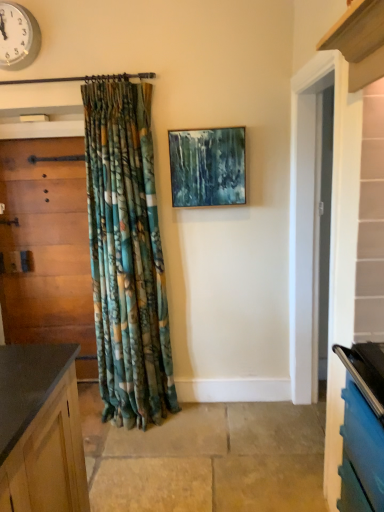
Question: Does wooden door at left have a smaller size compared to teal acrylic painting at center?

Choices:
 (A) no
 (B) yes

Answer: (A)

Question: Could you tell me if wooden door at left is facing teal acrylic painting at center?

Choices:
 (A) yes
 (B) no

Answer: (B)

Question: Is teal acrylic painting at center at the back of wooden door at left?

Choices:
 (A) yes
 (B) no

Answer: (B)

Question: From the image's perspective, does wooden door at left appear higher than teal acrylic painting at center?

Choices:
 (A) no
 (B) yes

Answer: (A)

Question: Is wooden door at left completely or partially outside of teal acrylic painting at center?

Choices:
 (A) no
 (B) yes

Answer: (B)

Question: Is wooden door at left surrounding teal acrylic painting at center?

Choices:
 (A) yes
 (B) no

Answer: (B)

Question: Is metallic clock at upper left looking in the opposite direction of wooden door at left?

Choices:
 (A) yes
 (B) no

Answer: (B)

Question: Considering the relative sizes of metallic clock at upper left and wooden door at left in the image provided, is metallic clock at upper left shorter than wooden door at left?

Choices:
 (A) yes
 (B) no

Answer: (A)

Question: Does metallic clock at upper left have a lesser width compared to wooden door at left?

Choices:
 (A) yes
 (B) no

Answer: (A)

Question: From a real-world perspective, is metallic clock at upper left positioned over wooden door at left based on gravity?

Choices:
 (A) no
 (B) yes

Answer: (B)

Question: Would you consider metallic clock at upper left to be distant from wooden door at left?

Choices:
 (A) yes
 (B) no

Answer: (A)

Question: Is metallic clock at upper left completely or partially outside of wooden door at left?

Choices:
 (A) no
 (B) yes

Answer: (B)

Question: Can you confirm if wooden door at left is positioned to the right of metallic clock at upper left?

Choices:
 (A) no
 (B) yes

Answer: (A)